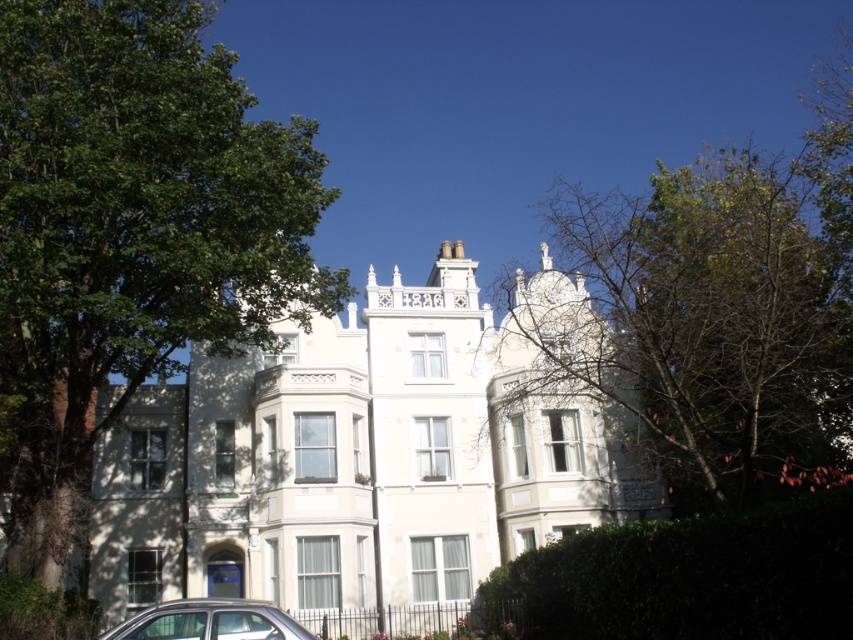
You are standing in front of the residential building and want to determine which is taller between the green leafy tree at left and the green leafy hedge at lower right. Can you tell me which one is taller?

The green leafy tree at left is taller than the green leafy hedge at lower right according to the description.

You are standing in front of the residential building and want to take a photo that includes both the green leafy tree at upper right and the silver metallic car at lower left. Which object should be placed to the right side of the other?

The green leafy tree at upper right is positioned on the right side of silver metallic car at lower left.

You are a landscape architect reviewing the image of the building. You notice the green leafy tree at left and the green leafy tree at upper right. Which tree would cast a larger shadow on the building during midday?

The green leafy tree at upper right would cast a larger shadow on the building during midday because it is larger than the green leafy tree at left.